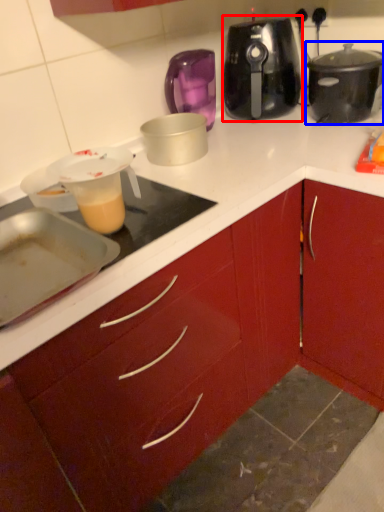
Question: Which of the following is the closest to the observer, slow cooker (highlighted by a red box) or slow cooker (highlighted by a blue box)?

Choices:
 (A) slow cooker
 (B) slow cooker

Answer: (B)